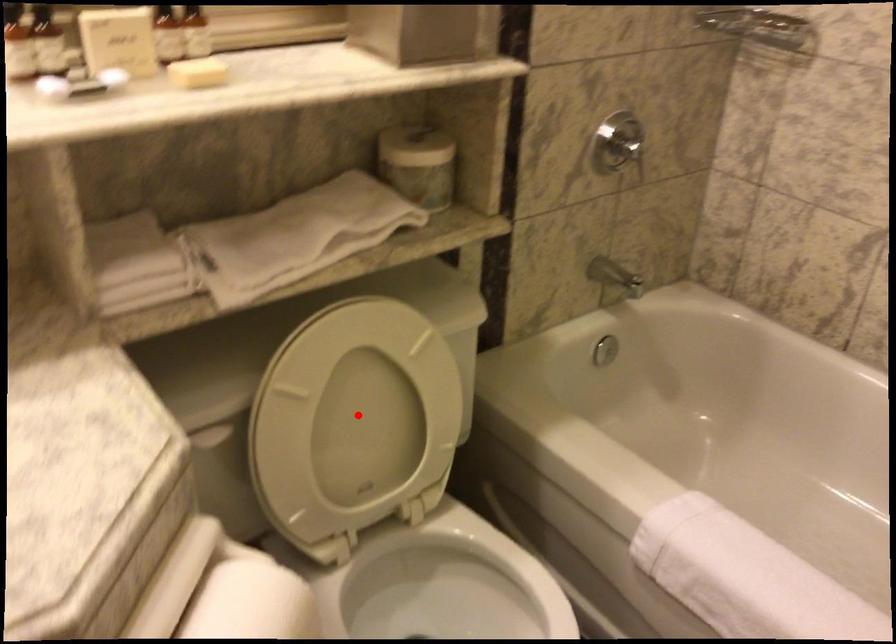
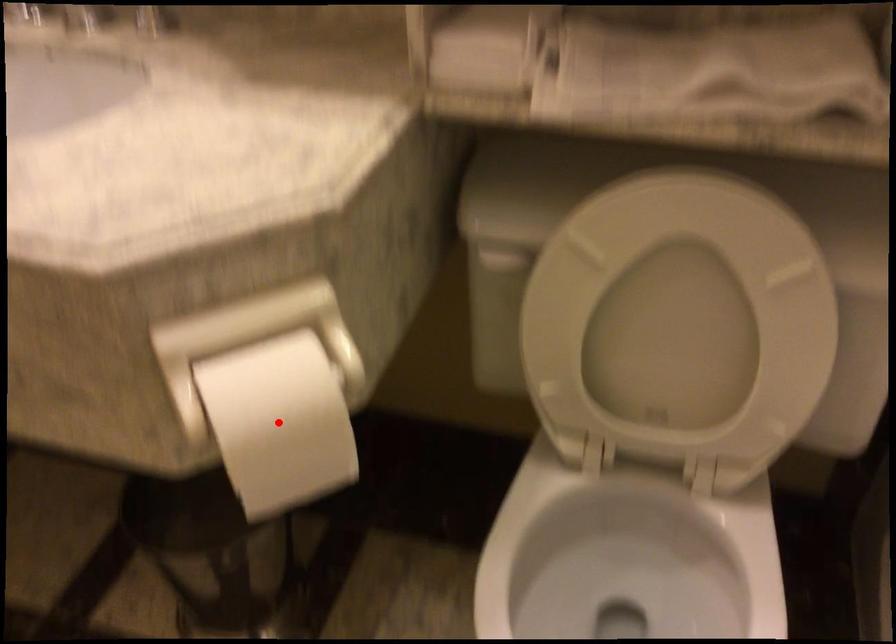
I am providing you with two images of the same scene from different viewpoints. A red point is marked on the first image and another point is marked on the second image. Does the point marked in image1 correspond to the same location as the one in image2?

No